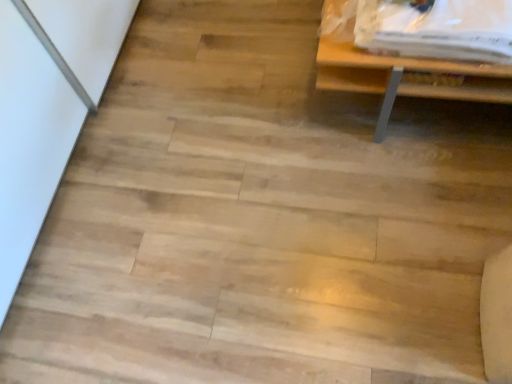
I want to click on vacant space to the left of wooden table at upper right, so (249, 109).